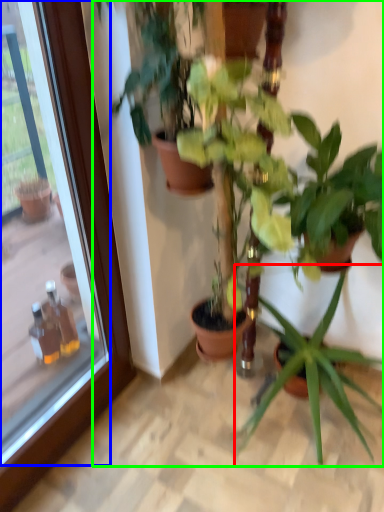
Question: Considering the real-world distances, which object is farthest from houseplant (highlighted by a red box)? glass door (highlighted by a blue box) or houseplant (highlighted by a green box)?

Choices:
 (A) glass door
 (B) houseplant

Answer: (A)